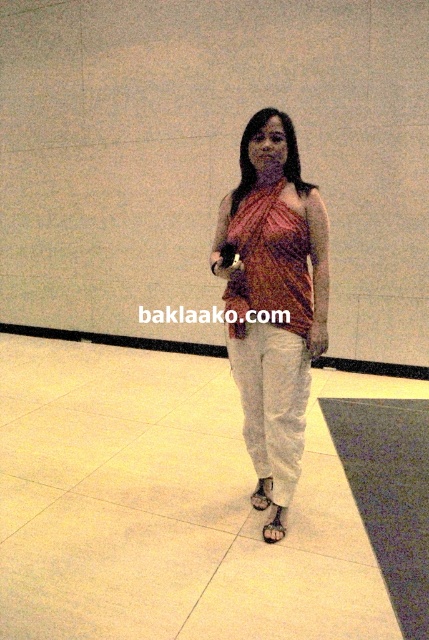
Who is positioned more to the left, pink fabric dress at center or black leather sandal at lower center?

Positioned to the left is black leather sandal at lower center.

Does pink fabric dress at center have a larger size compared to black leather sandal at lower center?

Yes, pink fabric dress at center is bigger than black leather sandal at lower center.

The height and width of the screenshot is (640, 429). I want to click on pink fabric dress at center, so click(274, 294).

Between brown leather sandal at lower center and black leather sandal at lower center, which one has less height?

brown leather sandal at lower center

Consider the image. Between brown leather sandal at lower center and black leather sandal at lower center, which one has more height?

black leather sandal at lower center

Find the location of a particular element. The width and height of the screenshot is (429, 640). brown leather sandal at lower center is located at coordinates (274, 525).

Locate an element on the screen. The image size is (429, 640). brown leather sandal at lower center is located at coordinates (274, 525).

Does pink fabric dress at center appear over brown leather sandal at lower center?

Yes, pink fabric dress at center is above brown leather sandal at lower center.

Based on the photo, measure the distance between point (x=308, y=241) and camera.

Point (x=308, y=241) is 2.27 meters from camera.

Where is `pink fabric dress at center`? pink fabric dress at center is located at coordinates (274, 294).